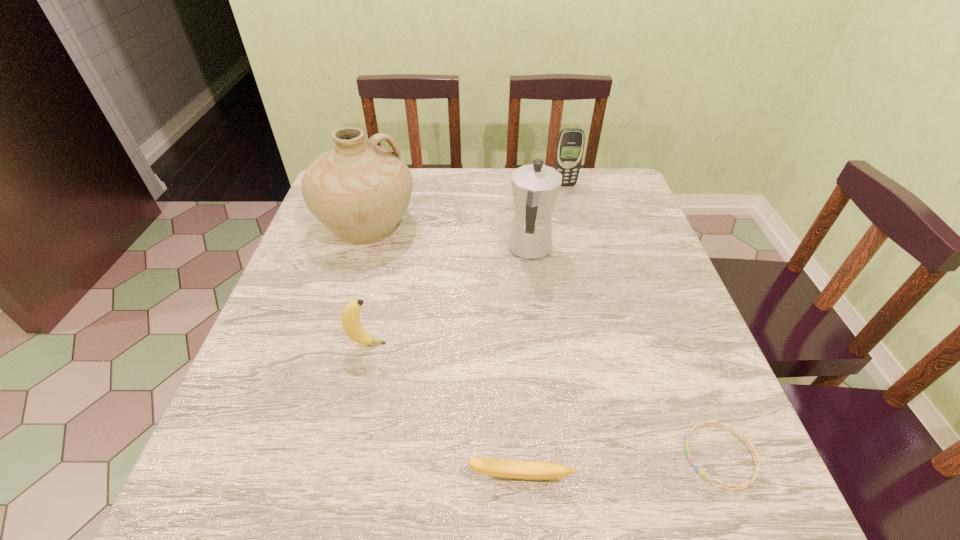
At what (x,y) coordinates should I click in order to perform the action: click on unoccupied area between the rightmost object and the cellular telephone. Please return your answer as a coordinate pair (x, y). This screenshot has height=540, width=960. Looking at the image, I should click on (642, 320).

Locate an element on the screen. The image size is (960, 540). empty location between the third tallest object and the fourth farthest object is located at coordinates 466,265.

Locate an element on the screen. This screenshot has height=540, width=960. empty space between the nearer banana and the left banana is located at coordinates (444, 410).

Where is `the fourth closest object to the coffeepot`? Image resolution: width=960 pixels, height=540 pixels. the fourth closest object to the coffeepot is located at coordinates (757, 467).

Image resolution: width=960 pixels, height=540 pixels. Identify the location of object that stands as the second closest to the third nearest object. (517, 469).

Image resolution: width=960 pixels, height=540 pixels. Find the location of `vacant area that satisfies the following two spatial constraints: 1. on the screen of the fourth shortest object; 2. from the stem of the taller banana`. vacant area that satisfies the following two spatial constraints: 1. on the screen of the fourth shortest object; 2. from the stem of the taller banana is located at coordinates (605, 344).

At what (x,y) coordinates should I click in order to perform the action: click on free point that satisfies the following two spatial constraints: 1. on the screen of the farthest object; 2. from the stem of the third nearest object. Please return your answer as a coordinate pair (x, y). Looking at the image, I should click on (605, 344).